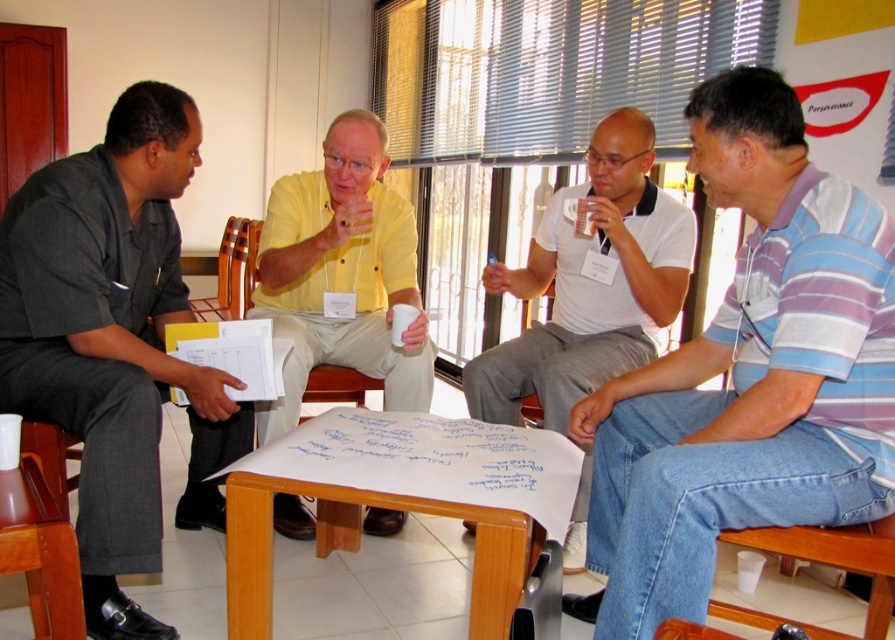
You are standing at the entrance of the room and want to place a 1.5 meter tall plant next to the wooden table at center. Considering the height of the brown wood chair at lower left, will the plant be taller than the chair?

The wooden table at center is shorter than the brown wood chair at lower left. Since the plant is 1.5 meters tall, and the chair is taller than the table, but we don not have the exact height of the chair. Therefore, it is uncertain whether the plant will be taller than the chair without knowing the chair height.

You are standing in the room and want to determine which of the two points, point (627, 301) or point (405, 333), is closer to you. Based on the scene description, which point is nearer?

Point (627, 301) is further to the viewer than point (405, 333), so the closer point to you is point (405, 333).

You are organizing a small meeting and need to place a name tag for the man in the yellow matte shirt at center on the wooden table at center. Considering their sizes, will the name tag fit comfortably on the table without overlapping the shirt?

The wooden table at center is wider than the yellow matte shirt at center, so the name tag should fit comfortably without overlapping the shirt.